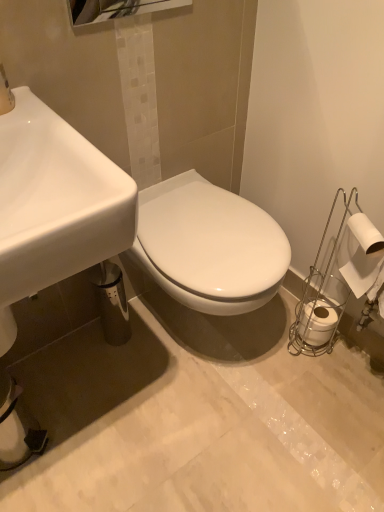
Question: From the image's perspective, is white glossy sink at lower left above white matte toilet paper at right, which ranks as the first toilet paper in top-to-bottom order?

Choices:
 (A) yes
 (B) no

Answer: (B)

Question: Could you tell me if white glossy sink at lower left is turned towards white matte toilet paper at right, arranged as the second toilet paper when viewed from the back?

Choices:
 (A) yes
 (B) no

Answer: (B)

Question: Is white glossy sink at lower left not inside white matte toilet paper at right, which is counted as the first toilet paper, starting from the front?

Choices:
 (A) no
 (B) yes

Answer: (B)

Question: Is white glossy sink at lower left taller than white matte toilet paper at right, arranged as the second toilet paper when viewed from the back?

Choices:
 (A) yes
 (B) no

Answer: (A)

Question: Is white glossy sink at lower left behind white matte toilet paper at right, which ranks as the first toilet paper in top-to-bottom order?

Choices:
 (A) no
 (B) yes

Answer: (A)

Question: Is white matte toilet paper at right, which ranks as the first toilet paper in top-to-bottom order, taller or shorter than polished chrome mirror at upper center?

Choices:
 (A) short
 (B) tall

Answer: (B)

Question: Would you say white matte toilet paper at right, which is counted as the first toilet paper, starting from the front, is to the left or to the right of polished chrome mirror at upper center in the picture?

Choices:
 (A) left
 (B) right

Answer: (B)

Question: Considering their positions, is white matte toilet paper at right, which is counted as the first toilet paper, starting from the front, located in front of or behind polished chrome mirror at upper center?

Choices:
 (A) front
 (B) behind

Answer: (B)

Question: Do you think white matte toilet paper at right, which is counted as the first toilet paper, starting from the front, is within polished chrome mirror at upper center, or outside of it?

Choices:
 (A) inside
 (B) outside

Answer: (B)

Question: From a real-world perspective, is white matte toilet paper at right, the first toilet paper in the back-to-front sequence, physically located above or below white glossy sink at lower left?

Choices:
 (A) above
 (B) below

Answer: (B)

Question: Considering their positions, is white matte toilet paper at right, which appears as the second toilet paper when viewed from the top, located in front of or behind white glossy sink at lower left?

Choices:
 (A) behind
 (B) front

Answer: (A)

Question: Is point (322, 298) positioned closer to the camera than point (28, 214)?

Choices:
 (A) closer
 (B) farther

Answer: (B)

Question: Considering the positions of white matte toilet paper at right, positioned as the second toilet paper in front-to-back order, and white glossy sink at lower left in the image, is white matte toilet paper at right, positioned as the second toilet paper in front-to-back order, bigger or smaller than white glossy sink at lower left?

Choices:
 (A) small
 (B) big

Answer: (A)

Question: Relative to polished chrome mirror at upper center, is white glossy sink at lower left in front or behind?

Choices:
 (A) front
 (B) behind

Answer: (A)

Question: In terms of width, does white glossy sink at lower left look wider or thinner when compared to polished chrome mirror at upper center?

Choices:
 (A) thin
 (B) wide

Answer: (B)